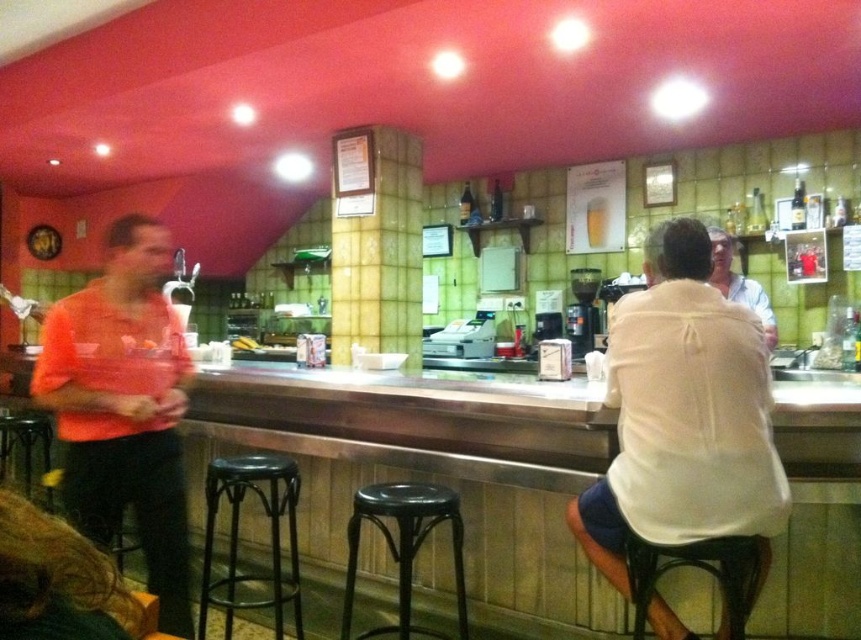
Question: Which of the following is the closest to the observer?

Choices:
 (A) orange t-shirt at left
 (B) white cotton shirt at center
 (C) white cotton shirt at right

Answer: (C)

Question: Which point is closer to the camera taking this photo?

Choices:
 (A) (465, 602)
 (B) (798, 196)

Answer: (A)

Question: Is white cotton shirt at center above translucent glass beer at center?

Choices:
 (A) no
 (B) yes

Answer: (A)

Question: Considering the relative positions of white cotton shirt at right and orange t-shirt at left in the image provided, where is white cotton shirt at right located with respect to orange t-shirt at left?

Choices:
 (A) left
 (B) right

Answer: (B)

Question: Can you confirm if black metal bar stool at lower left is positioned above white cotton shirt at center?

Choices:
 (A) no
 (B) yes

Answer: (A)

Question: Estimate the real-world distances between objects in this image. Which object is closer to the white cotton shirt at center?

Choices:
 (A) translucent glass bottle at upper right
 (B) black metal bar stool at lower left

Answer: (A)